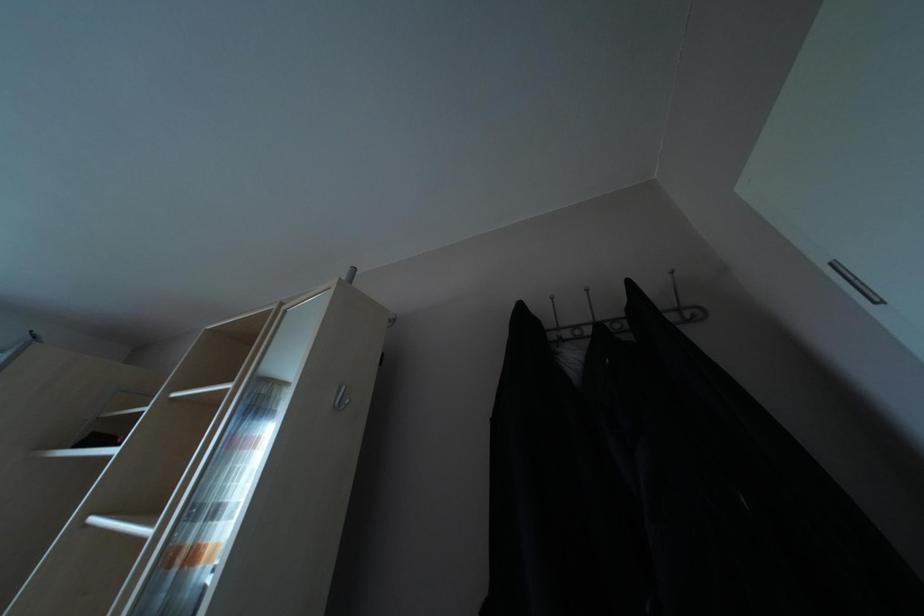
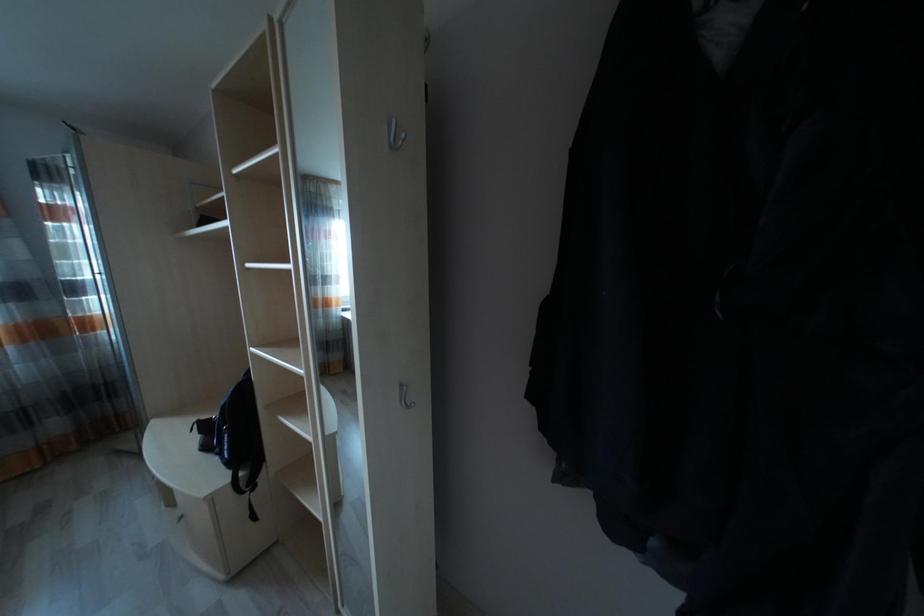
Question: Based on the continuous images, in which direction is the camera rotating? Reply with the corresponding letter.

Choices:
 (A) Left
 (B) Right
 (C) Up
 (D) Down

Answer: (D)